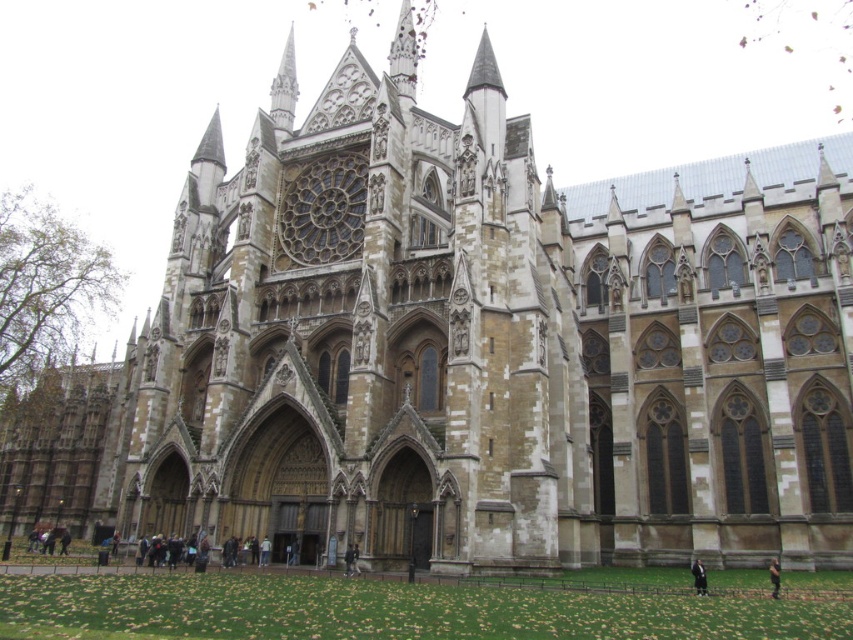
Who is taller, dark gray wool coat at lower right or dark brown leather jacket at lower right?

dark gray wool coat at lower right is taller.

Is point (697, 573) closer to camera compared to point (778, 573)?

That is True.

Which is behind, point (695, 589) or point (776, 576)?

Positioned behind is point (695, 589).

The height and width of the screenshot is (640, 853). Find the location of `dark gray wool coat at lower right`. dark gray wool coat at lower right is located at coordinates (699, 577).